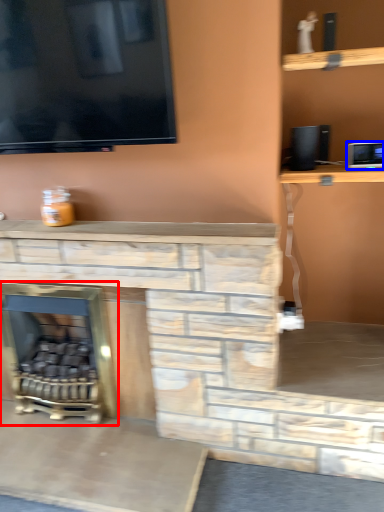
Question: Which of the following is the farthest to the observer, fireplace (highlighted by a red box) or appliance (highlighted by a blue box)?

Choices:
 (A) fireplace
 (B) appliance

Answer: (A)